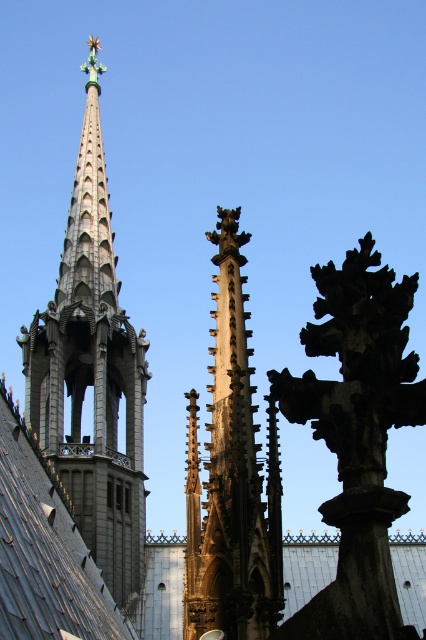
You are a maintenance worker needing to inspect both the brown stone spire at center and the gray slate roof at center. You have a ladder that is 16 meters long. Can you reach both objects with the ladder without moving it? Please explain your reasoning.

The brown stone spire at center is 15.94 meters away from the gray slate roof at center. Since the ladder is 16 meters long, it is slightly longer than the distance between them. Therefore, the ladder can be positioned to reach both objects without needing to be moved.

You are an architect examining the cathedral spires. Which spire, the gray stone spire at upper left or the brown stone spire at center, reaches a greater height?

The gray stone spire at upper left is taller than the brown stone spire at center, so it reaches a greater height.

You are standing at the entrance of the cathedral and want to locate the brown stone spire at center. According to the coordinates provided, where should you look relative to your current position?

The brown stone spire at center is located at coordinates point [232,477], which means it is positioned to the right and slightly above your current line of sight from the entrance.